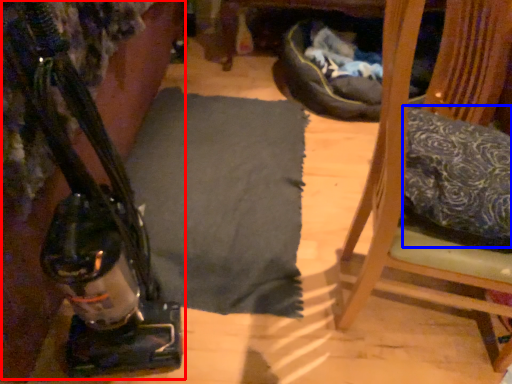
Question: Which object is further to the camera taking this photo, job (highlighted by a red box) or pillow (highlighted by a blue box)?

Choices:
 (A) job
 (B) pillow

Answer: (B)